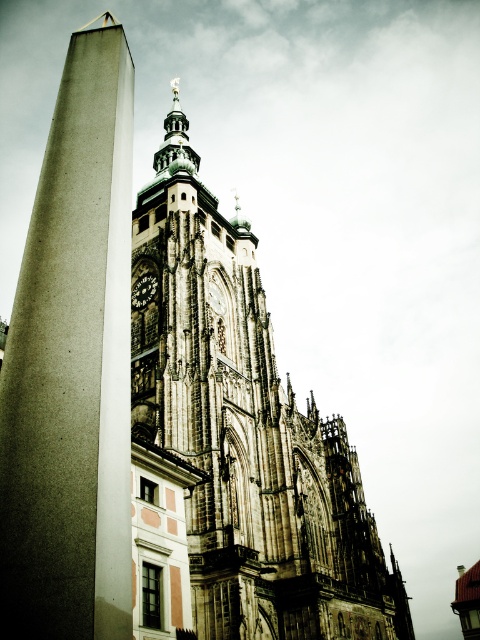
Question: Which object is closer to the camera taking this photo?

Choices:
 (A) smooth concrete pillar at left
 (B) dark gray stone clock at upper center
 (C) brown stone tower at center

Answer: (A)

Question: Observing the image, what is the correct spatial positioning of smooth concrete pillar at left in reference to dark gray stone clock at upper center?

Choices:
 (A) right
 (B) left

Answer: (A)

Question: Does brown stone tower at center have a smaller size compared to smooth concrete pillar at left?

Choices:
 (A) yes
 (B) no

Answer: (B)

Question: Estimate the real-world distances between objects in this image. Which object is farther from the dark gray stone clock at upper center?

Choices:
 (A) smooth concrete pillar at left
 (B) brown stone tower at center

Answer: (A)

Question: Which object is the closest to the brown stone tower at center?

Choices:
 (A) dark gray stone clock at upper center
 (B) smooth concrete pillar at left

Answer: (A)

Question: Can you confirm if smooth concrete pillar at left is bigger than dark gray stone clock at upper center?

Choices:
 (A) yes
 (B) no

Answer: (A)